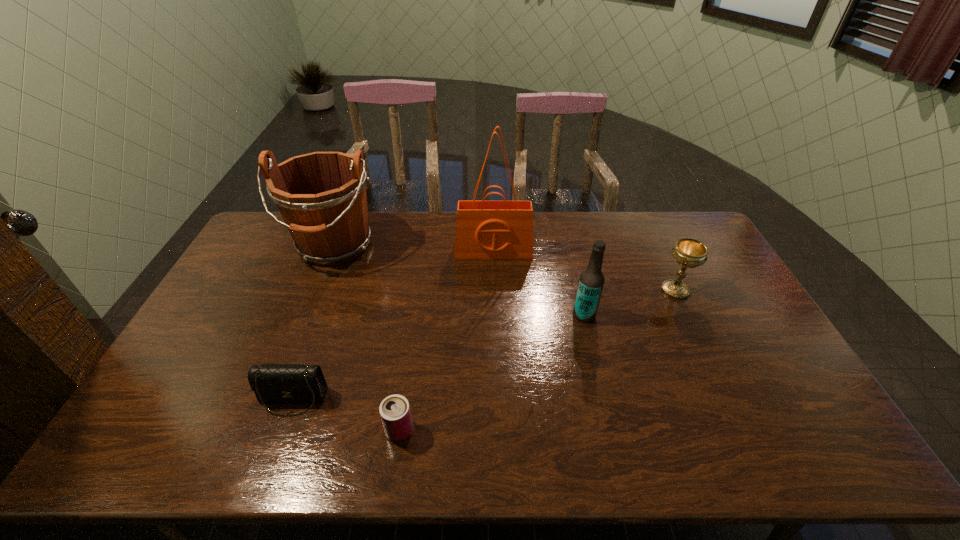
You are a GUI agent. You are given a task and a screenshot of the screen. Output one action in this format:
    pyautogui.click(x=<x>, y=<y>)
    Task: Click on the free space located on the logo side of the tallest object
    The image size is (960, 540).
    Given the screenshot: What is the action you would take?
    pyautogui.click(x=495, y=300)

Image resolution: width=960 pixels, height=540 pixels. What are the coordinates of `vacant point located 0.080m with the handle on the side of the bucket` in the screenshot? It's located at (314, 294).

Locate an element on the screen. vacant region located 0.130m on the side of the fourth shortest object with the label is located at coordinates (530, 315).

Identify the location of free space located 0.070m on the side of the fourth shortest object with the label. This screenshot has width=960, height=540. (550, 315).

This screenshot has width=960, height=540. In order to click on vacant space situated 0.290m on the side of the fourth shortest object with the label in this screenshot , I will do `click(478, 315)`.

You are a GUI agent. You are given a task and a screenshot of the screen. Output one action in this format:
    pyautogui.click(x=<x>, y=<y>)
    Task: Click on the vacant space situated on the back of the rightmost object
    
    Given the screenshot: What is the action you would take?
    pyautogui.click(x=659, y=255)

At what (x,y) coordinates should I click in order to perform the action: click on blank space located on the front flap of the clutch bag. Please return your answer as a coordinate pair (x, y). Image resolution: width=960 pixels, height=540 pixels. Looking at the image, I should click on (276, 448).

Locate an element on the screen. This screenshot has height=540, width=960. free location located 0.220m on the left of the fourth object from right to left is located at coordinates (295, 430).

Where is `tote bag located in the far edge section of the desktop`? The height and width of the screenshot is (540, 960). tote bag located in the far edge section of the desktop is located at coordinates (484, 229).

Locate an element on the screen. bucket that is at the far edge is located at coordinates (321, 196).